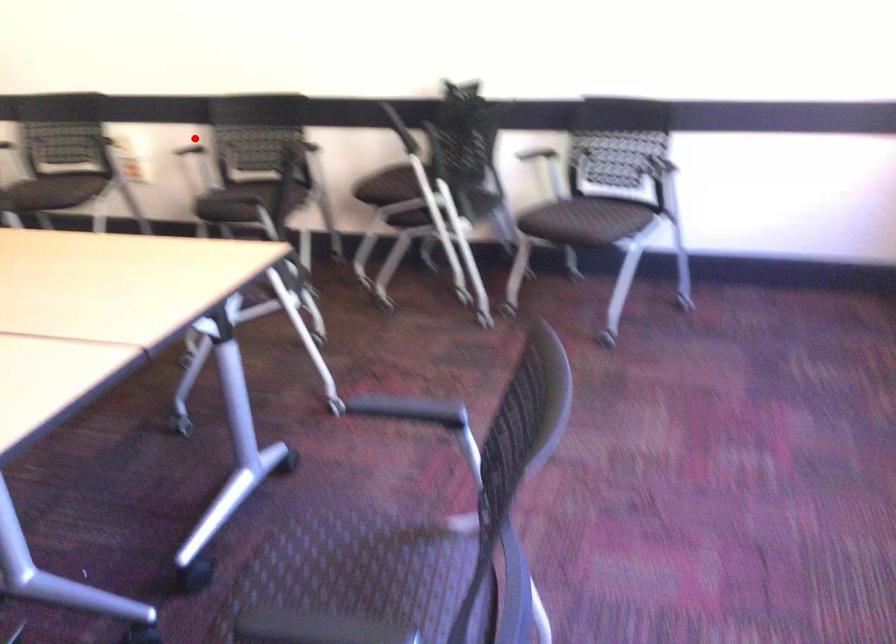
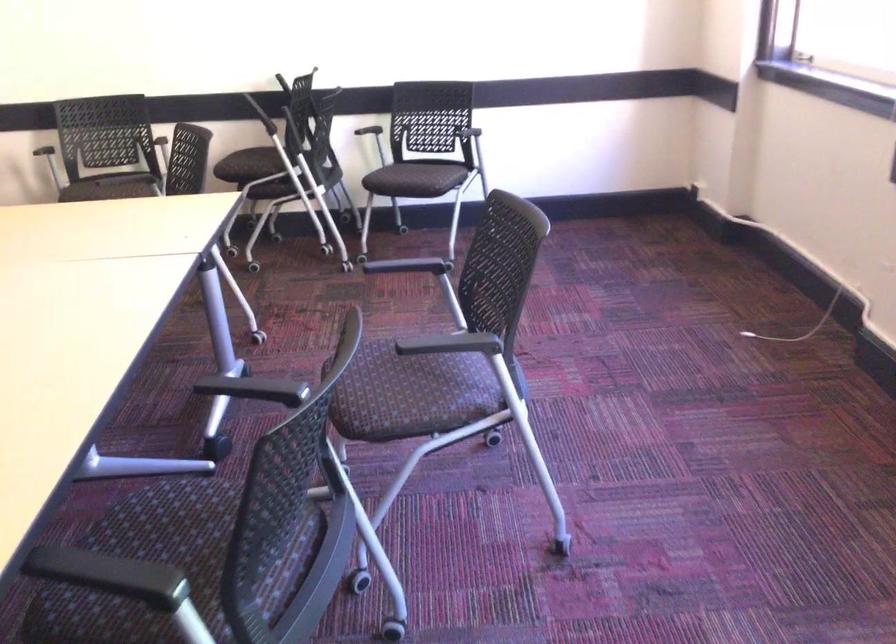
In the second image, find the point that corresponds to the highlighted location in the first image.

(30, 140)